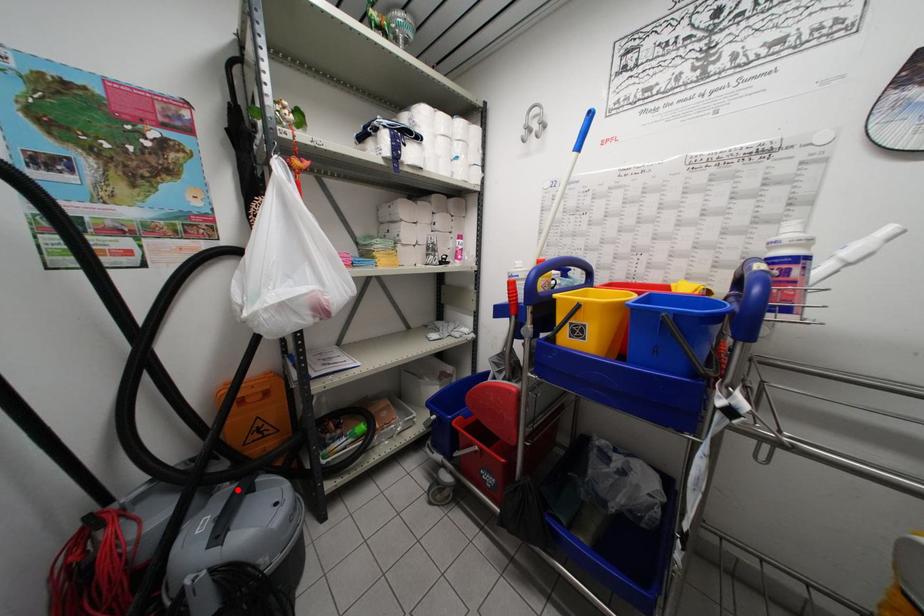
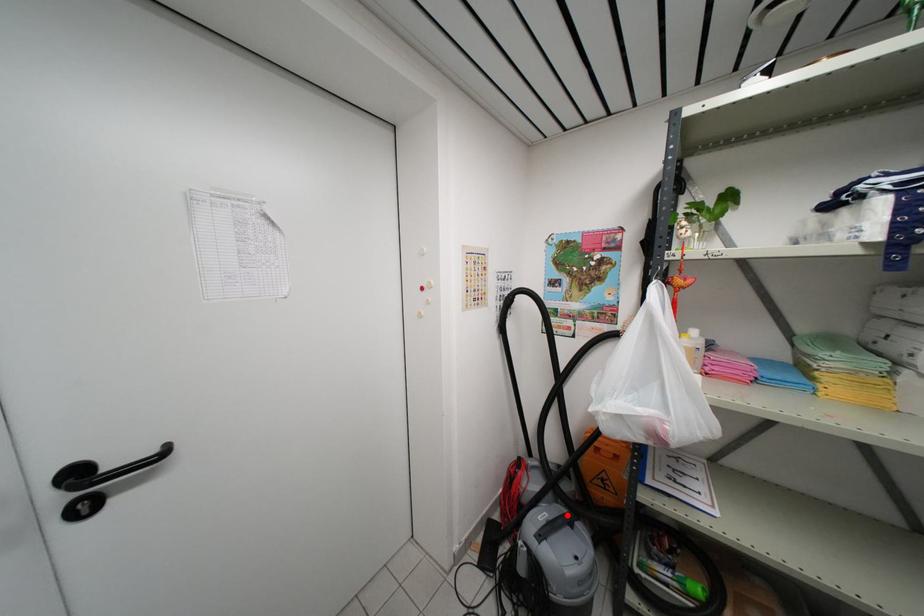
I am providing you with two images of the same scene from different viewpoints. A red point is marked on the first image and another point is marked on the second image. Does the point marked in image1 correspond to the same location as the one in image2?

Yes